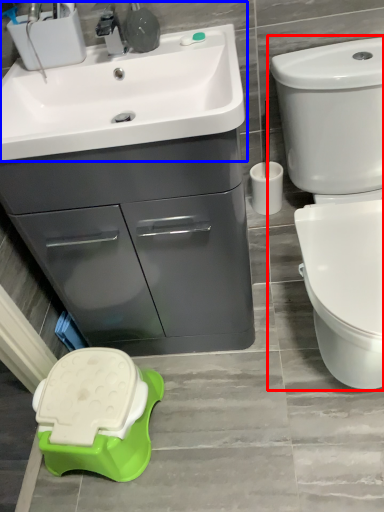
Question: Among these objects, which one is farthest to the camera, toilet (highlighted by a red box) or sink (highlighted by a blue box)?

Choices:
 (A) toilet
 (B) sink

Answer: (B)